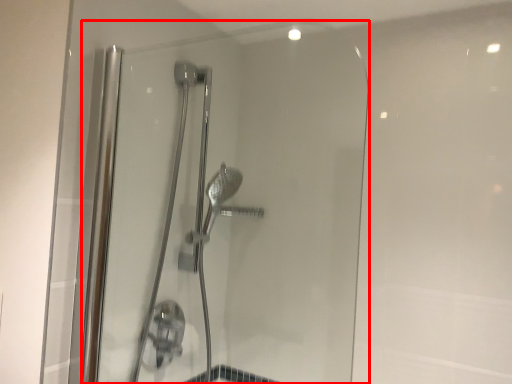
Question: From the image's perspective, where is shower door (annotated by the red box) located in relation to shower door in the image?

Choices:
 (A) below
 (B) above

Answer: (B)